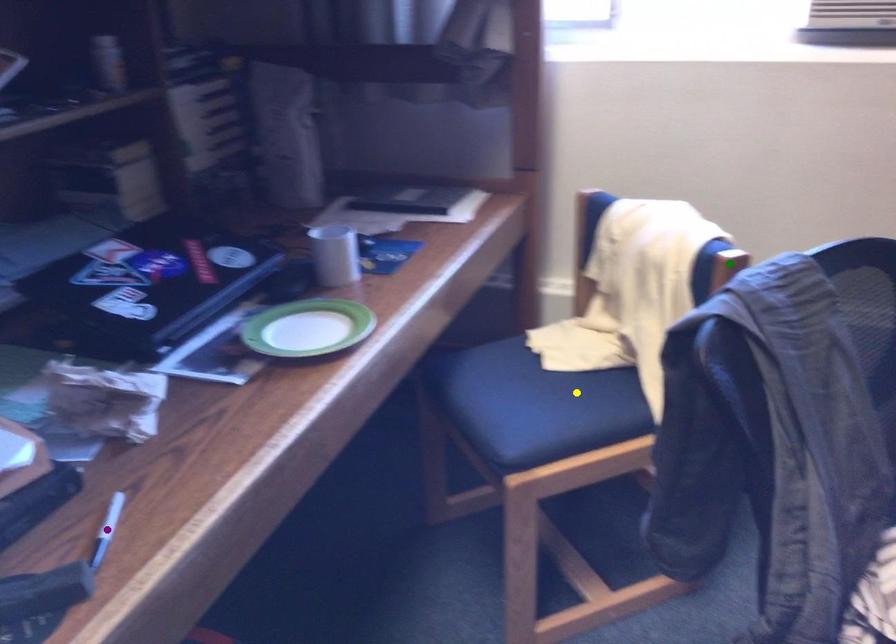
Order these from nearest to farthest:
1. yellow point
2. green point
3. purple point

yellow point
green point
purple point